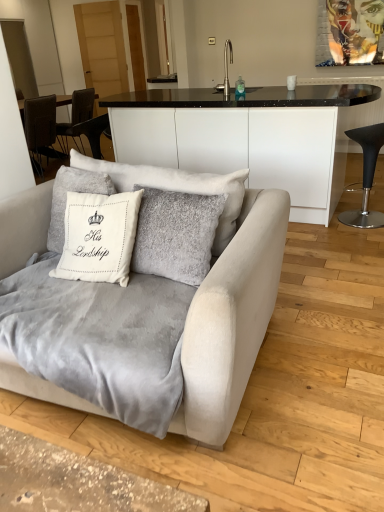
Question: Can we say suede gray couch at lower left lies outside white soft cushion at center?

Choices:
 (A) yes
 (B) no

Answer: (A)

Question: Can you confirm if suede gray couch at lower left is wider than white soft cushion at center?

Choices:
 (A) yes
 (B) no

Answer: (A)

Question: Is suede gray couch at lower left taller than white soft cushion at center?

Choices:
 (A) no
 (B) yes

Answer: (B)

Question: Considering the relative sizes of suede gray couch at lower left and white soft cushion at center in the image provided, is suede gray couch at lower left thinner than white soft cushion at center?

Choices:
 (A) no
 (B) yes

Answer: (A)

Question: Is suede gray couch at lower left bigger than white soft cushion at center?

Choices:
 (A) no
 (B) yes

Answer: (B)

Question: From the image's perspective, relative to white soft cushion at center, is black leather stool at right above or below?

Choices:
 (A) above
 (B) below

Answer: (A)

Question: In terms of width, does black leather stool at right look wider or thinner when compared to white soft cushion at center?

Choices:
 (A) wide
 (B) thin

Answer: (A)

Question: In terms of size, does black leather stool at right appear bigger or smaller than white soft cushion at center?

Choices:
 (A) big
 (B) small

Answer: (A)

Question: From a real-world perspective, is black leather stool at right above or below white soft cushion at center?

Choices:
 (A) below
 (B) above

Answer: (A)

Question: From their relative heights in the image, would you say black leather stool at right is taller or shorter than suede gray couch at lower left?

Choices:
 (A) short
 (B) tall

Answer: (A)

Question: Is black leather stool at right to the left or to the right of suede gray couch at lower left in the image?

Choices:
 (A) left
 (B) right

Answer: (B)

Question: Looking at the image, does black leather stool at right seem bigger or smaller compared to suede gray couch at lower left?

Choices:
 (A) small
 (B) big

Answer: (A)

Question: Do you think black leather stool at right is within suede gray couch at lower left, or outside of it?

Choices:
 (A) inside
 (B) outside

Answer: (B)

Question: Is suede gray couch at lower left to the left or to the right of metallic faucet at upper center in the image?

Choices:
 (A) right
 (B) left

Answer: (B)

Question: Considering the positions of suede gray couch at lower left and metallic faucet at upper center in the image, is suede gray couch at lower left bigger or smaller than metallic faucet at upper center?

Choices:
 (A) big
 (B) small

Answer: (A)